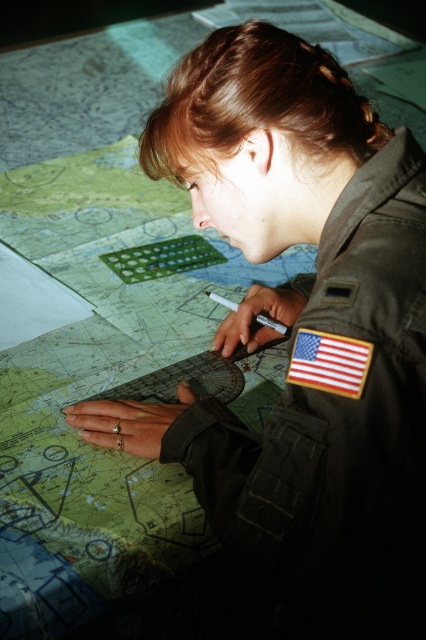
You are a photographer taking a picture of the person in the scene. The brown hair at upper center and the american flag patch at upper center are both important elements to capture. Which object should you focus on first to ensure it is clearly visible in the photo?

The american flag patch at upper center is behind the brown hair at upper center, so you should focus on the brown hair at upper center first to ensure it doesn not block the flag patch in the photo.

You are a photographer positioned at the camera location. You need to capture a closeup shot of the brown hair at upper center. The camera can focus on objects within 25 inches. Will you be able to take the closeup shot without moving the camera or the subject?

The brown hair at upper center is 27.22 inches from the camera, which is beyond the camera focus range of 25 inches. Therefore, you cannot take the closeup shot without adjusting the camera or subject position.

You are a drone operator viewing this scene from above. You need to determine the order of two points on the map. Which point is closer to you, point [319,118] or point [319,378]?

Point [319,378] is closer to you because point [319,118] is behind it.